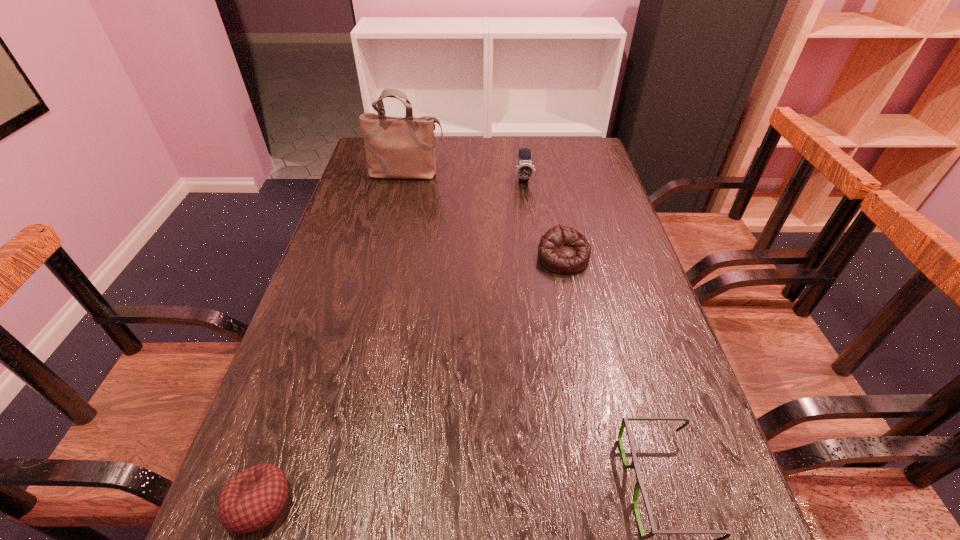
Image resolution: width=960 pixels, height=540 pixels. In order to click on watch at the far edge in this screenshot , I will do `click(525, 169)`.

You are a GUI agent. You are given a task and a screenshot of the screen. Output one action in this format:
    pyautogui.click(x=<x>, y=<y>)
    Task: Click on the shoulder bag situated at the left edge
    The height and width of the screenshot is (540, 960).
    Given the screenshot: What is the action you would take?
    pyautogui.click(x=400, y=148)

This screenshot has height=540, width=960. What are the coordinates of `beanbag that is at the left edge` in the screenshot? It's located at (254, 498).

Identify the location of object that is at the right edge. The image size is (960, 540). (562, 249).

Find the location of a particular element. This screenshot has width=960, height=540. object located at the far left corner is located at coordinates (400, 148).

The image size is (960, 540). In the image, there is a desktop. Identify the location of vacant space at the far edge. (437, 168).

The height and width of the screenshot is (540, 960). In the image, there is a desktop. What are the coordinates of `free space at the left edge` in the screenshot? It's located at (339, 450).

The width and height of the screenshot is (960, 540). I want to click on vacant space at the right edge of the desktop, so click(609, 181).

In the image, there is a desktop. Find the location of `free space at the far left corner`. free space at the far left corner is located at coordinates (357, 163).

You are a GUI agent. You are given a task and a screenshot of the screen. Output one action in this format:
    pyautogui.click(x=<x>, y=<y>)
    Task: Click on the vacant space at the far right corner
    This screenshot has width=960, height=540.
    Given the screenshot: What is the action you would take?
    pyautogui.click(x=574, y=137)